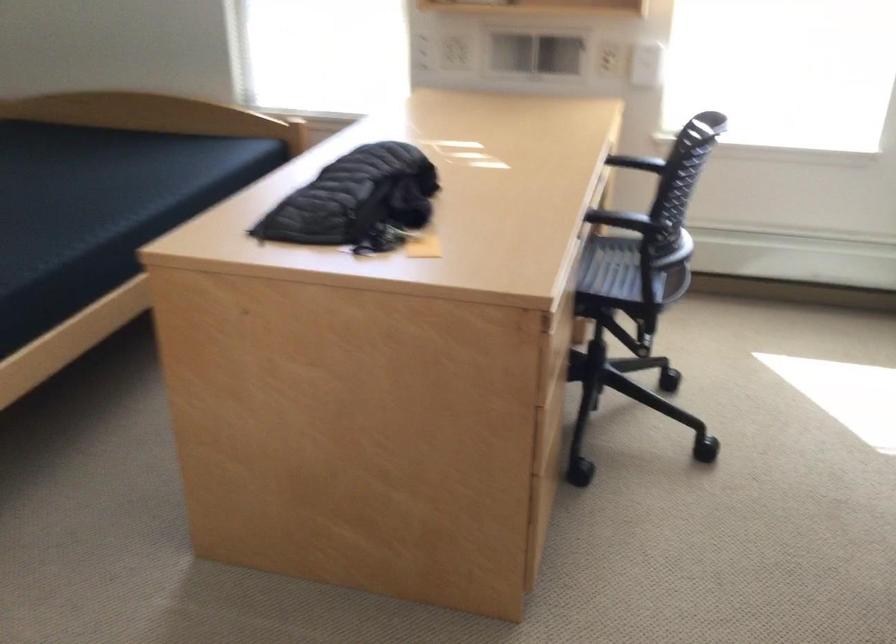
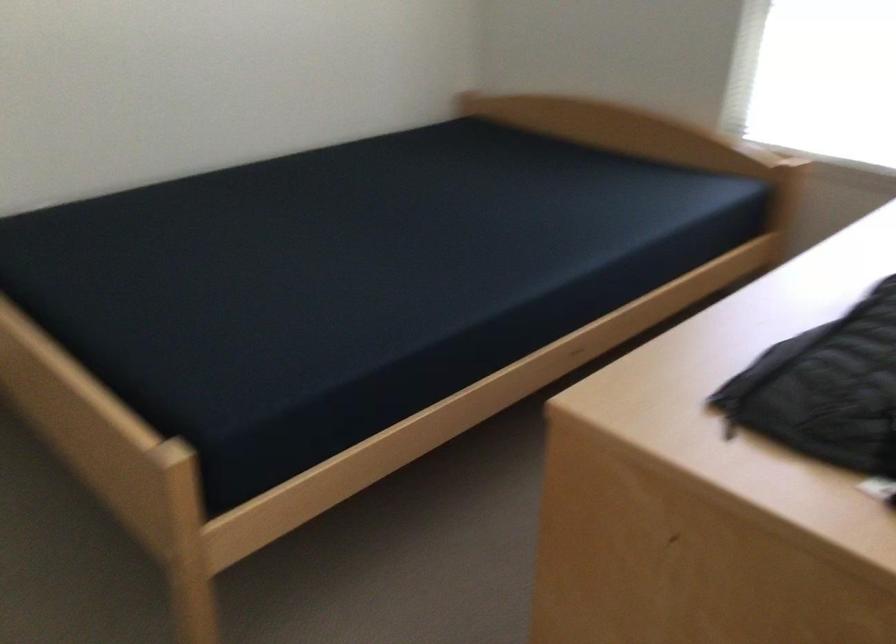
Question: The first image is from the beginning of the video and the second image is from the end. How did the camera likely rotate when shooting the video?

Choices:
 (A) Left
 (B) Right
 (C) Up
 (D) Down

Answer: (A)